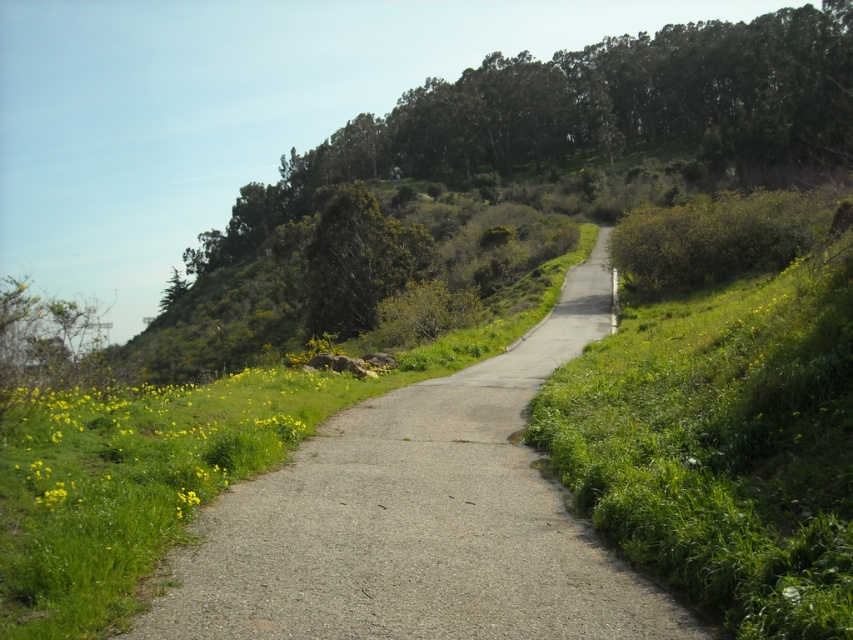
You are a gardener planning to mow the yellow grass at lower left and trim the green textured tree at upper center. Based on their heights, which task should you tackle first if you want to start with the shorter one?

The yellow grass at lower left has a lesser height compared to the green textured tree at upper center, so you should mow the yellow grass at lower left first since it is shorter.

You are standing at the starting point of the path and want to reach the green leafy tree at upper center. What direction should you walk to reach it?

The green leafy tree at upper center is located at point (585, 115), so you should walk towards the upper center direction to reach it.

You are standing at the starting point of the path and want to reach the green leafy tree at upper center. Which direction should you head towards from the path?

The green leafy tree at upper center is located at point (585, 115), so you should head towards the upper center direction from the path to reach it.